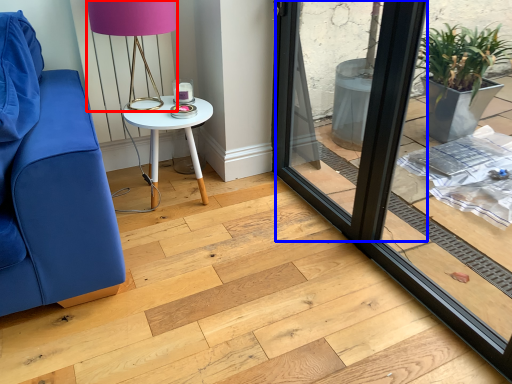
Question: Which point is further to the camera, table lamp (highlighted by a red box) or screen door (highlighted by a blue box)?

Choices:
 (A) table lamp
 (B) screen door

Answer: (A)